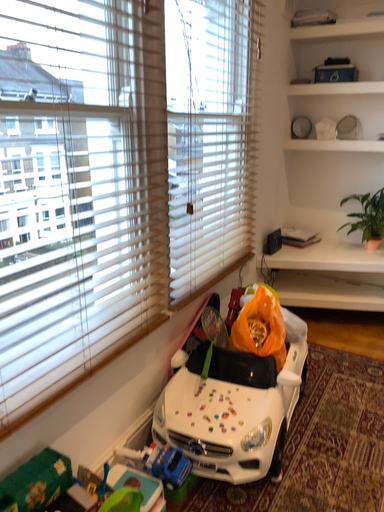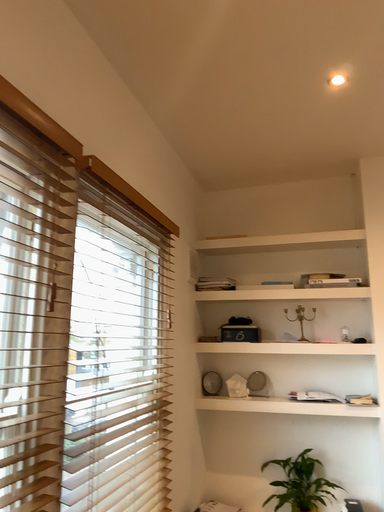
Question: How did the camera likely rotate when shooting the video?

Choices:
 (A) rotated left
 (B) rotated right

Answer: (B)